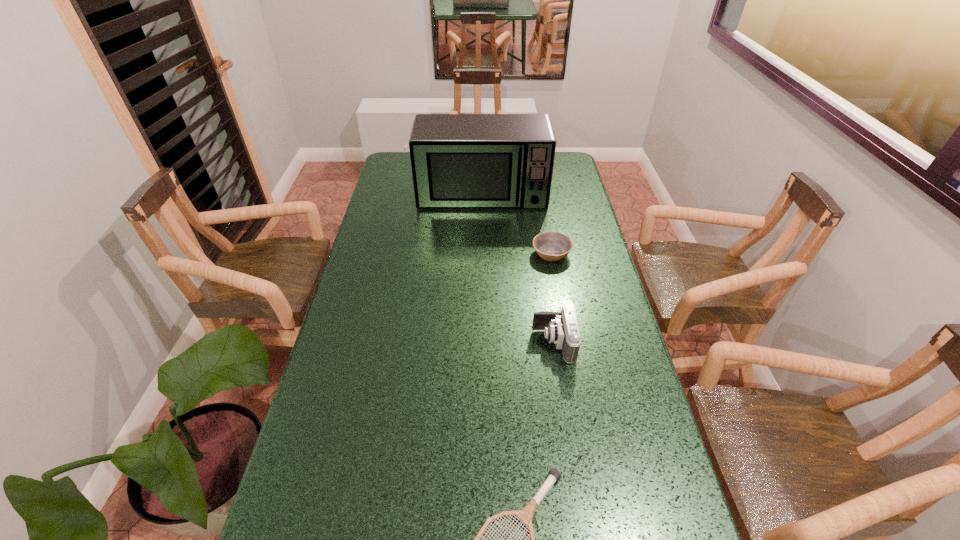
This screenshot has width=960, height=540. What are the coordinates of `free space between the third tallest object and the third shortest object` in the screenshot? It's located at (552, 298).

In order to click on vacant space that is in between the farthest object and the third nearest object in this screenshot , I will do `click(516, 224)`.

Identify the location of free space that is in between the tallest object and the third tallest object. Image resolution: width=960 pixels, height=540 pixels. (516, 224).

You are a GUI agent. You are given a task and a screenshot of the screen. Output one action in this format:
    pyautogui.click(x=<x>, y=<y>)
    Task: Click on the vacant area that lies between the camera and the third tallest object
    The height and width of the screenshot is (540, 960).
    Given the screenshot: What is the action you would take?
    pyautogui.click(x=552, y=298)

Where is `vacant space that is in between the second shortest object and the farthest object`? Image resolution: width=960 pixels, height=540 pixels. vacant space that is in between the second shortest object and the farthest object is located at coordinates (516, 224).

Where is `object that stands as the second closest to the third farthest object`? This screenshot has width=960, height=540. object that stands as the second closest to the third farthest object is located at coordinates (526, 514).

Locate an element on the screen. the third closest object relative to the nearest object is located at coordinates (458, 160).

You are a GUI agent. You are given a task and a screenshot of the screen. Output one action in this format:
    pyautogui.click(x=<x>, y=<y>)
    Task: Click on the free space that satisfies the following two spatial constraints: 1. on the front side of the third tallest object; 2. at the front of the third shortest object with an open lens cover
    
    Given the screenshot: What is the action you would take?
    pyautogui.click(x=567, y=342)